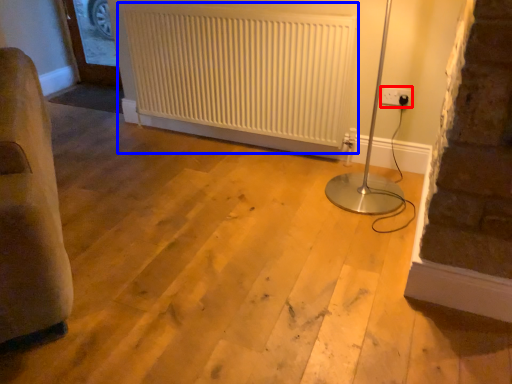
Question: Which object is further to the camera taking this photo, electric outlet (highlighted by a red box) or radiator (highlighted by a blue box)?

Choices:
 (A) electric outlet
 (B) radiator

Answer: (A)